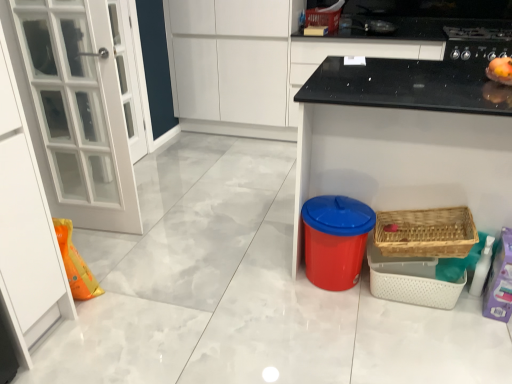
Question: Considering the positions of point (309, 24) and point (305, 208), is point (309, 24) closer or farther from the camera than point (305, 208)?

Choices:
 (A) farther
 (B) closer

Answer: (A)

Question: Is wooden wicker basket at upper right, which is counted as the first basket, starting from the top, to the left or to the right of red plastic trash can at lower center, placed as the 2th appliance when sorted from top to bottom, in the image?

Choices:
 (A) left
 (B) right

Answer: (B)

Question: Considering the real-world distances, which object is closest to the red plastic trash can at lower center, positioned as the 2th appliance in back-to-front order?

Choices:
 (A) blue plastic bin at lower right
 (B) white matte cabinet at upper center
 (C) black glossy stove at upper right, which ranks as the 2th appliance in left-to-right order
 (D) wooden wicker basket at upper right, the 1th basket in the back-to-front sequence
 (E) woven wood basket at lower right, positioned as the first basket in bottom-to-top order

Answer: (E)

Question: Which is farther from the wooden wicker basket at upper right, the 1th basket in the back-to-front sequence?

Choices:
 (A) black glossy stove at upper right, positioned as the second appliance in front-to-back order
 (B) white matte cabinet at upper center
 (C) woven wood basket at lower right, which is counted as the first basket, starting from the front
 (D) blue plastic bin at lower right
 (E) red plastic trash can at lower center, the first appliance when ordered from left to right

Answer: (E)